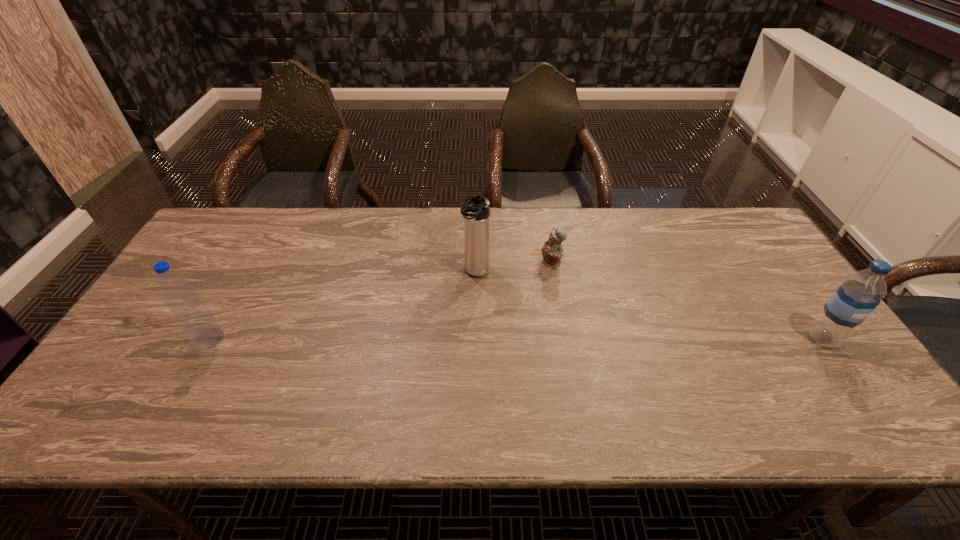
Image resolution: width=960 pixels, height=540 pixels. I want to click on free space between the third object from right to left and the shortest object, so click(514, 268).

Locate an element on the screen. Image resolution: width=960 pixels, height=540 pixels. free space between the left water bottle and the right water bottle is located at coordinates (516, 339).

Identify which object is the closest to the leftmost object. Please provide its 2D coordinates. Your answer should be formatted as a tuple, i.e. [(x, y)], where the tuple contains the x and y coordinates of a point satisfying the conditions above.

[(476, 212)]

At what (x,y) coordinates should I click in order to perform the action: click on object that stands as the third closest to the leftmost object. Please return your answer as a coordinate pair (x, y). This screenshot has width=960, height=540. Looking at the image, I should click on (861, 292).

Where is `vacant space that satisfies the following two spatial constraints: 1. on the back side of the left water bottle; 2. on the left side of the second object from left to right`? This screenshot has width=960, height=540. vacant space that satisfies the following two spatial constraints: 1. on the back side of the left water bottle; 2. on the left side of the second object from left to right is located at coordinates (245, 273).